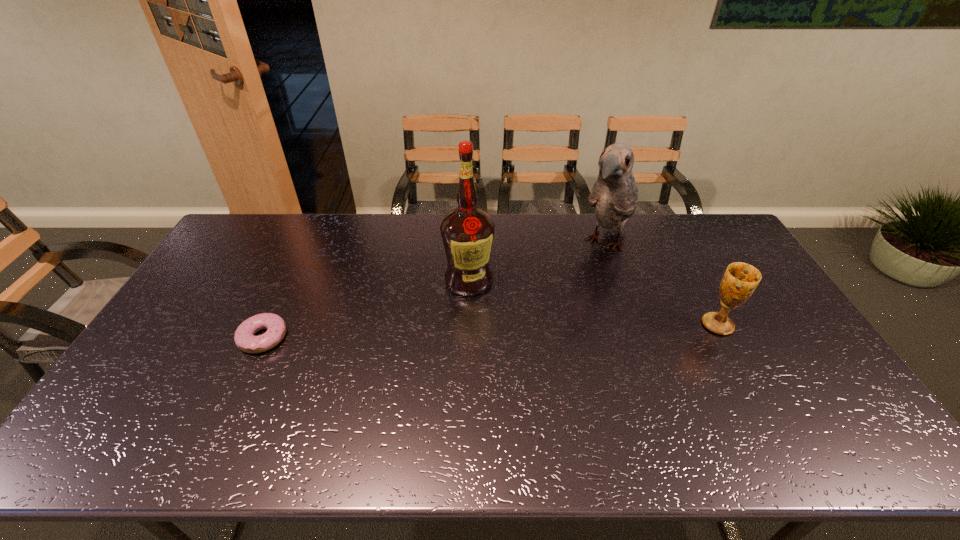
Locate an element on the screen. vacant space located 0.350m on the label of the alcohol is located at coordinates (401, 382).

This screenshot has width=960, height=540. What are the coordinates of `free space located on the label of the alcohol` in the screenshot? It's located at (413, 365).

Locate an element on the screen. blank space located on the front-facing side of the third object from left to right is located at coordinates (577, 299).

Where is `vacant region located on the front-facing side of the third object from left to right`? The width and height of the screenshot is (960, 540). vacant region located on the front-facing side of the third object from left to right is located at coordinates (567, 315).

Find the location of `free space located 0.150m on the front-facing side of the third object from left to right`. free space located 0.150m on the front-facing side of the third object from left to right is located at coordinates (581, 294).

Where is `object that is at the far edge`? object that is at the far edge is located at coordinates pyautogui.click(x=614, y=196).

This screenshot has height=540, width=960. Find the location of `vacant space at the far edge of the desktop`. vacant space at the far edge of the desktop is located at coordinates (643, 219).

This screenshot has width=960, height=540. In the image, there is a desktop. What are the coordinates of `blank space at the near edge` in the screenshot? It's located at (526, 398).

The image size is (960, 540). In order to click on vacant space at the left edge of the desktop in this screenshot , I will do `click(214, 255)`.

Identify the location of vacant space at the right edge of the desktop. This screenshot has height=540, width=960. (769, 359).